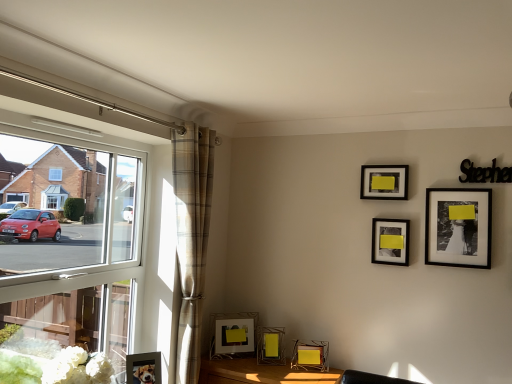
Question: Which direction should I rotate to look at matte glass picture frame at lower center, the 2th picture frame in the left-to-right sequence, — up or down?

Choices:
 (A) down
 (B) up

Answer: (A)

Question: Considering the relative sizes of metallic gold table at lower center and metallic wireframe picture frame at lower center, which is counted as the 4th picture frame, starting from the right, in the image provided, is metallic gold table at lower center shorter than metallic wireframe picture frame at lower center, which is counted as the 4th picture frame, starting from the right,?

Choices:
 (A) yes
 (B) no

Answer: (B)

Question: Is metallic wireframe picture frame at lower center, which is the fourth picture frame in left-to-right order, located within metallic gold table at lower center?

Choices:
 (A) yes
 (B) no

Answer: (B)

Question: Does metallic gold table at lower center have a larger size compared to metallic wireframe picture frame at lower center, which is counted as the 4th picture frame, starting from the right?

Choices:
 (A) no
 (B) yes

Answer: (B)

Question: Is metallic gold table at lower center beside metallic wireframe picture frame at lower center, which is the fourth picture frame in left-to-right order?

Choices:
 (A) no
 (B) yes

Answer: (A)

Question: Does metallic gold table at lower center come behind metallic wireframe picture frame at lower center, which is counted as the 4th picture frame, starting from the right?

Choices:
 (A) yes
 (B) no

Answer: (B)

Question: From a real-world perspective, is metallic gold table at lower center positioned under metallic wireframe picture frame at lower center, which is the fourth picture frame in left-to-right order, based on gravity?

Choices:
 (A) yes
 (B) no

Answer: (A)

Question: Considering the relative sizes of metallic silver picture frame at lower left, positioned as the first picture frame in left-to-right order, and matte glass picture frame at lower center, the 2th picture frame in the left-to-right sequence, in the image provided, is metallic silver picture frame at lower left, positioned as the first picture frame in left-to-right order, bigger than matte glass picture frame at lower center, the 2th picture frame in the left-to-right sequence,?

Choices:
 (A) no
 (B) yes

Answer: (A)

Question: Is metallic silver picture frame at lower left, positioned as the first picture frame in left-to-right order, aimed at matte glass picture frame at lower center, the 2th picture frame in the left-to-right sequence?

Choices:
 (A) no
 (B) yes

Answer: (A)

Question: Can you confirm if metallic silver picture frame at lower left, positioned as the first picture frame in left-to-right order, is smaller than matte glass picture frame at lower center, the 2th picture frame in the left-to-right sequence?

Choices:
 (A) yes
 (B) no

Answer: (A)

Question: From a real-world perspective, is metallic silver picture frame at lower left, positioned as the first picture frame in left-to-right order, on top of matte glass picture frame at lower center, the 2th picture frame in the left-to-right sequence?

Choices:
 (A) no
 (B) yes

Answer: (A)

Question: Does metallic silver picture frame at lower left, the 7th picture frame when ordered from right to left, appear on the left side of matte glass picture frame at lower center, marked as the 6th picture frame in a right-to-left arrangement?

Choices:
 (A) yes
 (B) no

Answer: (A)

Question: Is metallic silver picture frame at lower left, the 7th picture frame when ordered from right to left, facing away from matte glass picture frame at lower center, the 2th picture frame in the left-to-right sequence?

Choices:
 (A) no
 (B) yes

Answer: (A)

Question: From the image's perspective, is metallic wireframe picture frame at lower center, which is counted as the 4th picture frame, starting from the right, above plaid fabric curtain at left?

Choices:
 (A) yes
 (B) no

Answer: (B)